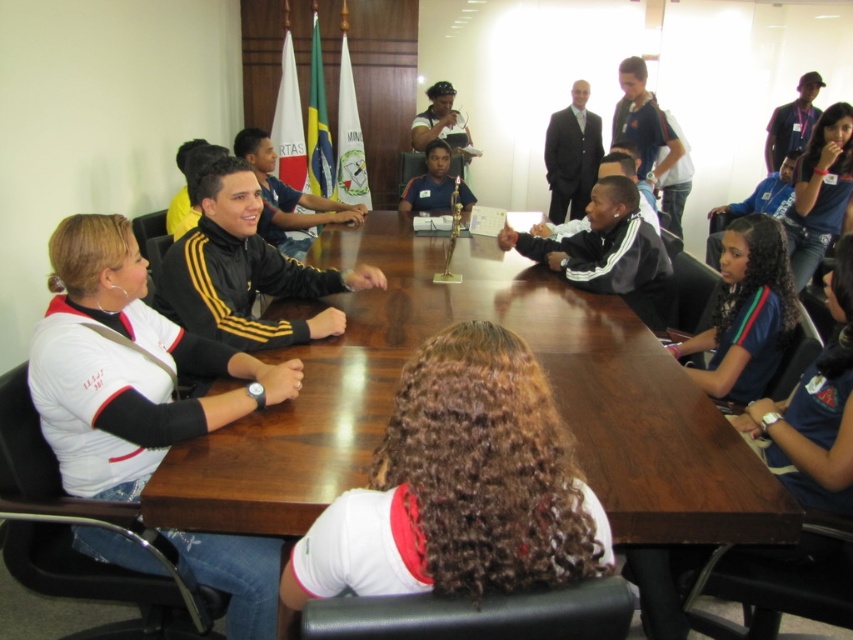
Can you confirm if white matte shirt at center is wider than blue denim shirt at upper right?

Correct, the width of white matte shirt at center exceeds that of blue denim shirt at upper right.

Between white matte shirt at center and blue denim shirt at upper right, which one is positioned higher?

blue denim shirt at upper right is above.

Between point (474, 490) and point (805, 204), which one is positioned behind?

Positioned behind is point (805, 204).

The height and width of the screenshot is (640, 853). What are the coordinates of `white matte shirt at center` in the screenshot? It's located at (460, 486).

Does dark blue jersey at lower right lie in front of matte blue shirt at center?

Yes, dark blue jersey at lower right is in front of matte blue shirt at center.

Describe the element at coordinates (746, 312) in the screenshot. I see `dark blue jersey at lower right` at that location.

Measure the distance between dark blue jersey at lower right and camera.

dark blue jersey at lower right and camera are 2.05 meters apart.

Where is `dark blue jersey at lower right`? The image size is (853, 640). dark blue jersey at lower right is located at coordinates (746, 312).

Who is more forward, (502, 273) or (442, 88)?

Positioned in front is point (502, 273).

The height and width of the screenshot is (640, 853). What are the coordinates of `wooden table at center` in the screenshot? It's located at (543, 365).

This screenshot has height=640, width=853. Identify the location of wooden table at center. (543, 365).